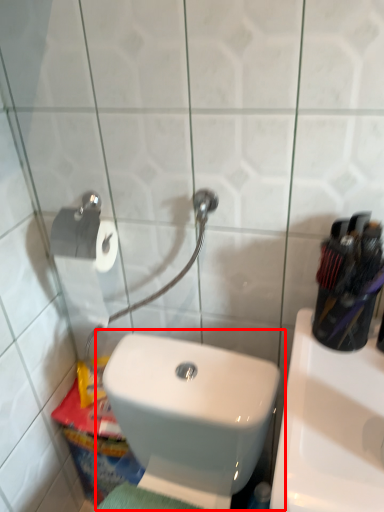
Question: From the image's perspective, what is the correct spatial positioning of toilet (annotated by the red box) in reference to sink?

Choices:
 (A) above
 (B) below

Answer: (B)